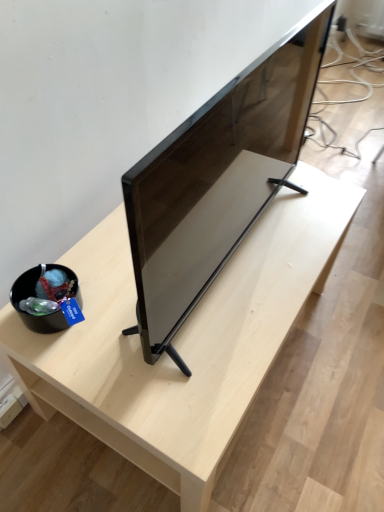
Identify the location of spots to the right of light wood table at center. (344, 346).